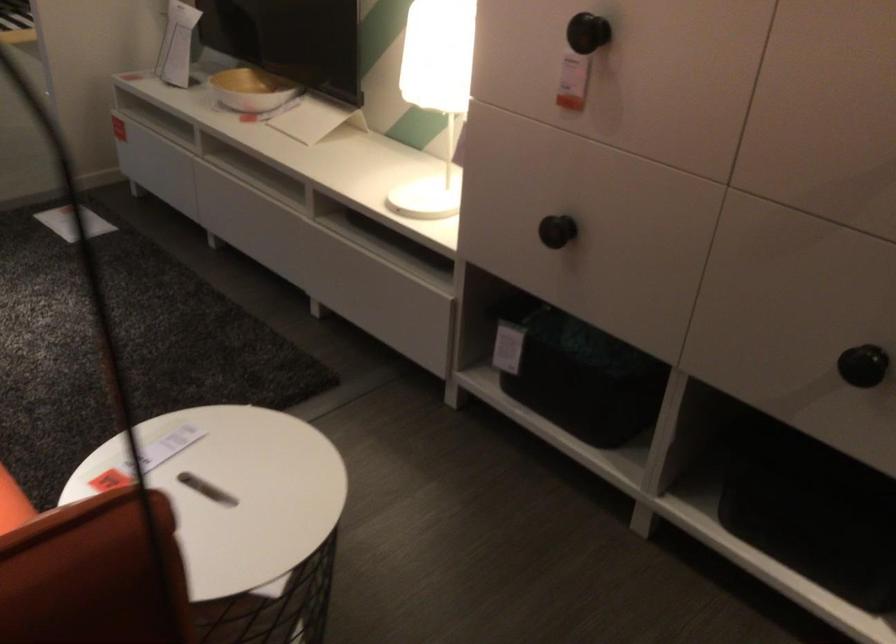
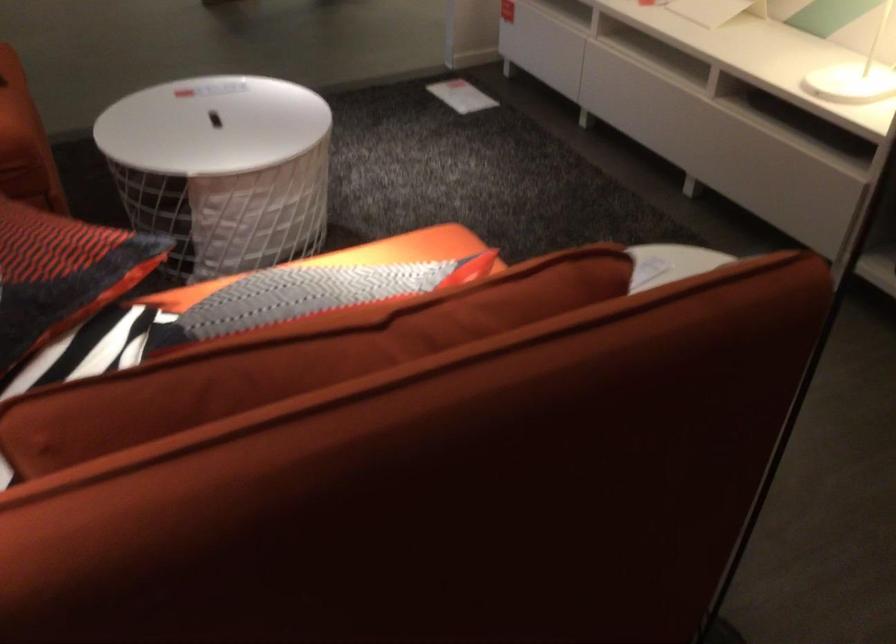
What movement of the cameraman would produce the second image?

The cameraman walked toward left, backward.